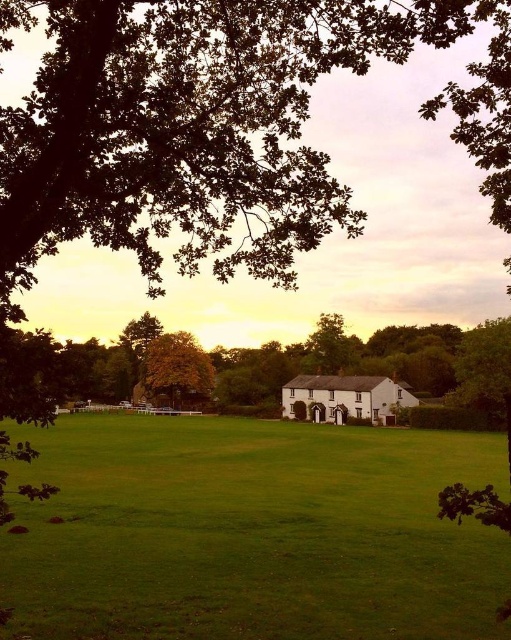
You are standing at the origin point in the scene. Which direction should you walk to reach the green grass field at center?

The green grass field at center is located at point 0.833 on the x axis and 0.495 on the y axis, so you should walk towards the right and slightly forward to reach it.